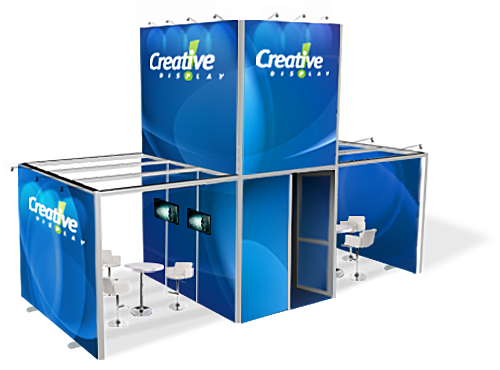
I want to click on walls, so click(224, 270), click(399, 203).